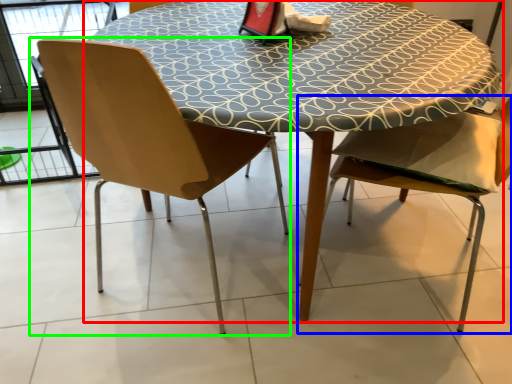
Question: Which object is positioned closest to table (highlighted by a red box)? Select from chair (highlighted by a blue box) and chair (highlighted by a green box).

Choices:
 (A) chair
 (B) chair

Answer: (B)